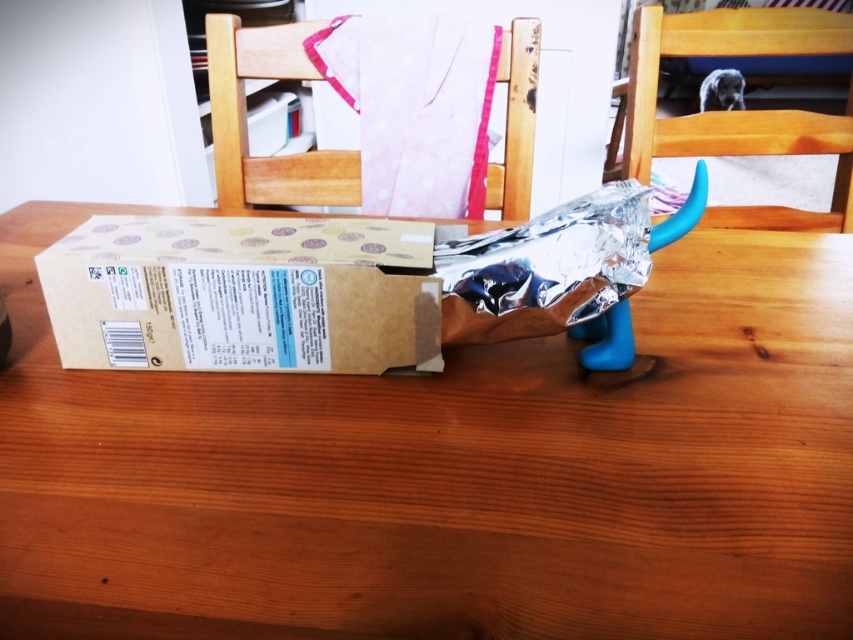
You are standing in a room with a wooden table at center and a wooden chair at upper right. If you want to move a box from the table to the chair, which direction should you move the box towards?

The wooden table at center is in front of the wooden chair at upper right, so you should move the box towards the upper right direction to place it on the wooden chair at upper right.

You are setting up a small display and need to know if the brown cardboard box at center can fit on the wooden table at center without overhanging. Can you confirm based on their sizes?

The wooden table at center is wider than the brown cardboard box at center, so the box can fit on the table without overhanging.